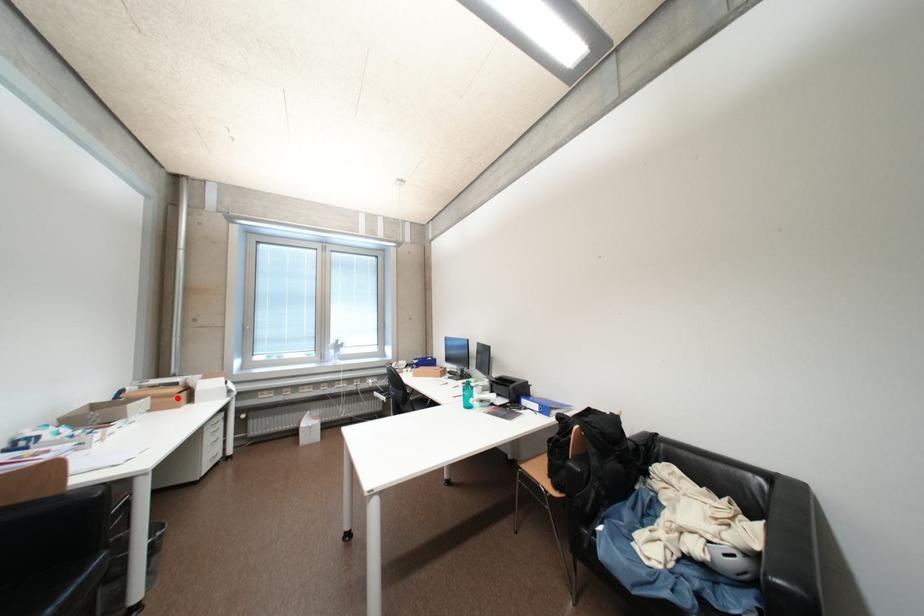
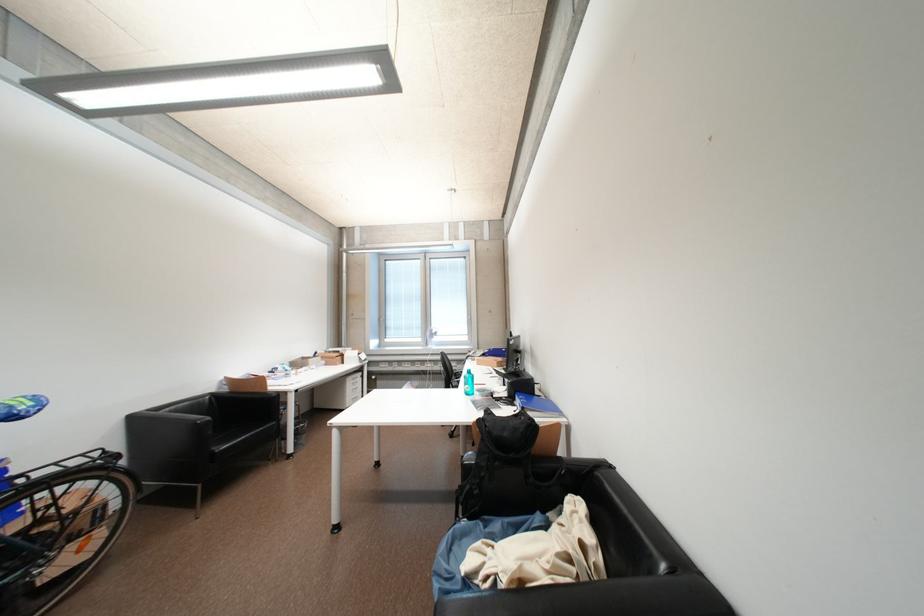
Question: I am providing you with two images of the same scene from different viewpoints. Image1 has a red point marked. In image2, the corresponding 3D location appears at what relative position? Reply with the corresponding letter.

Choices:
 (A) Closer
 (B) Farther

Answer: (B)